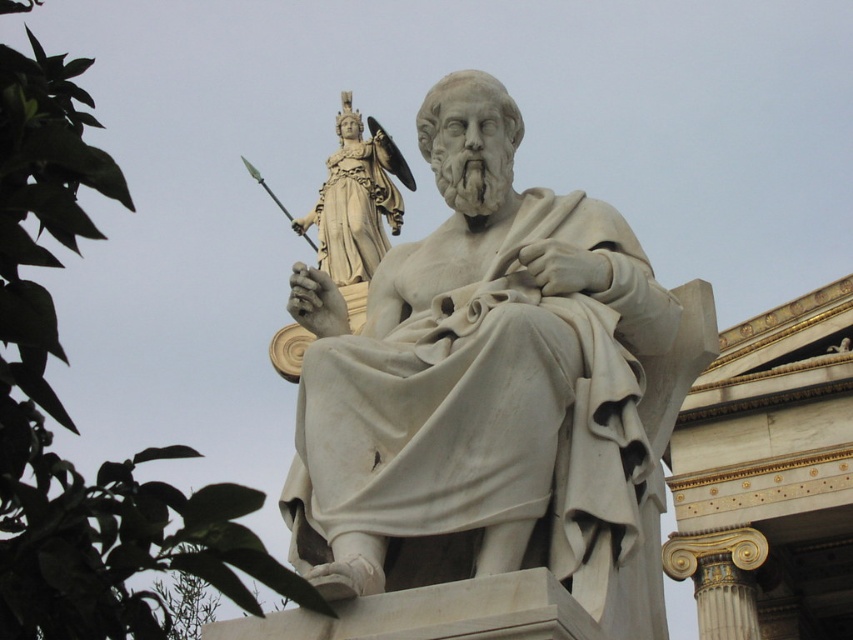
Is white marble statue at center positioned in front of golden polished statue at upper center?

Yes.

Which of these two, white marble statue at center or golden polished statue at upper center, stands taller?

Standing taller between the two is golden polished statue at upper center.

What do you see at coordinates (479, 381) in the screenshot? The width and height of the screenshot is (853, 640). I see `white marble statue at center` at bounding box center [479, 381].

You are a GUI agent. You are given a task and a screenshot of the screen. Output one action in this format:
    pyautogui.click(x=<x>, y=<y>)
    Task: Click on the white marble statue at center
    
    Given the screenshot: What is the action you would take?
    pyautogui.click(x=479, y=381)